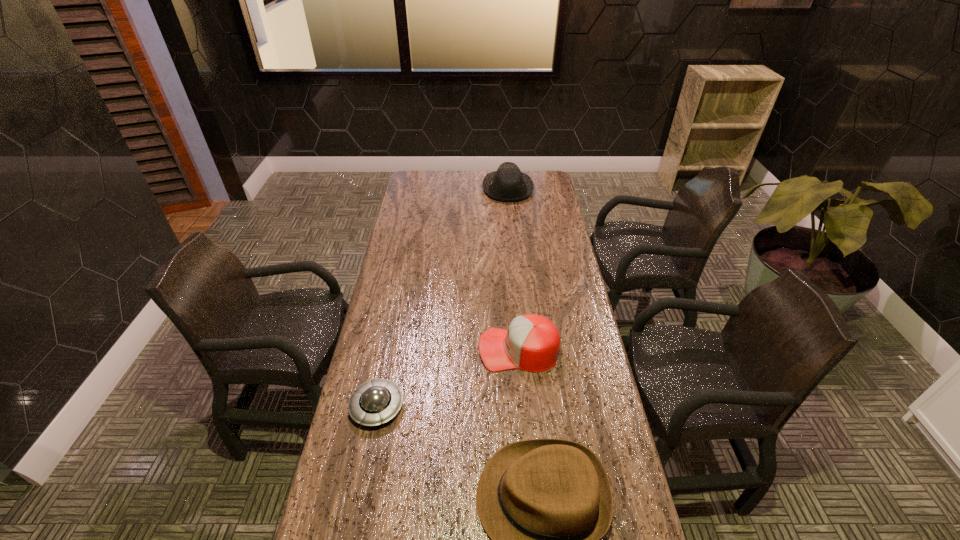
Find the location of a particular element. The width and height of the screenshot is (960, 540). free space between the farthest object and the baseball cap is located at coordinates (514, 269).

I want to click on free space between the leftmost object and the farthest object, so click(x=443, y=298).

Locate an element on the screen. The height and width of the screenshot is (540, 960). empty space that is in between the farther fedora and the baseball cap is located at coordinates (514, 269).

At what (x,y) coordinates should I click in order to perform the action: click on vacant area that lies between the baseball cap and the second nearest object. Please return your answer as a coordinate pair (x, y). The height and width of the screenshot is (540, 960). Looking at the image, I should click on (447, 378).

Where is `blank region between the farthest object and the second farthest object`? This screenshot has height=540, width=960. blank region between the farthest object and the second farthest object is located at coordinates (514, 269).

Where is `unoccupied position between the second farthest object and the saucer`? unoccupied position between the second farthest object and the saucer is located at coordinates (447, 378).

Identify the location of free space between the second nearest object and the farthest object. (443, 298).

Identify which object is located as the third nearest to the baseball cap. Please provide its 2D coordinates. Your answer should be formatted as a tuple, i.e. [(x, y)], where the tuple contains the x and y coordinates of a point satisfying the conditions above.

[(508, 184)]

The width and height of the screenshot is (960, 540). In order to click on the closest object relative to the nearest object in this screenshot , I will do `click(375, 402)`.